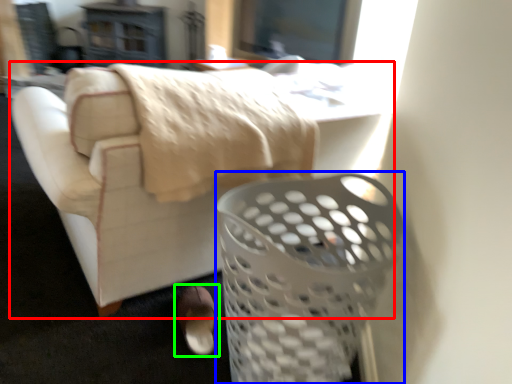
Question: Which is farther away from furniture (highlighted by a red box)? basket (highlighted by a blue box) or footwear (highlighted by a green box)?

Choices:
 (A) basket
 (B) footwear

Answer: (A)